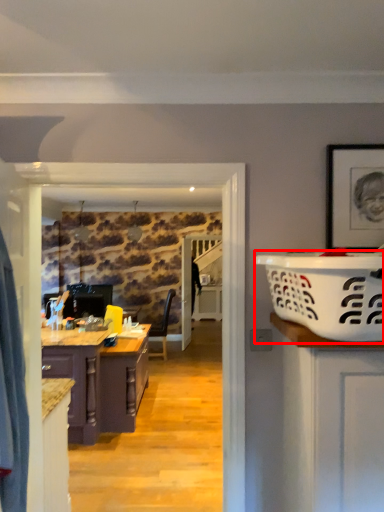
Question: From the image's perspective, considering the relative positions of basket (annotated by the red box) and cabinetry in the image provided, where is basket (annotated by the red box) located with respect to the staircase?

Choices:
 (A) above
 (B) below

Answer: (A)